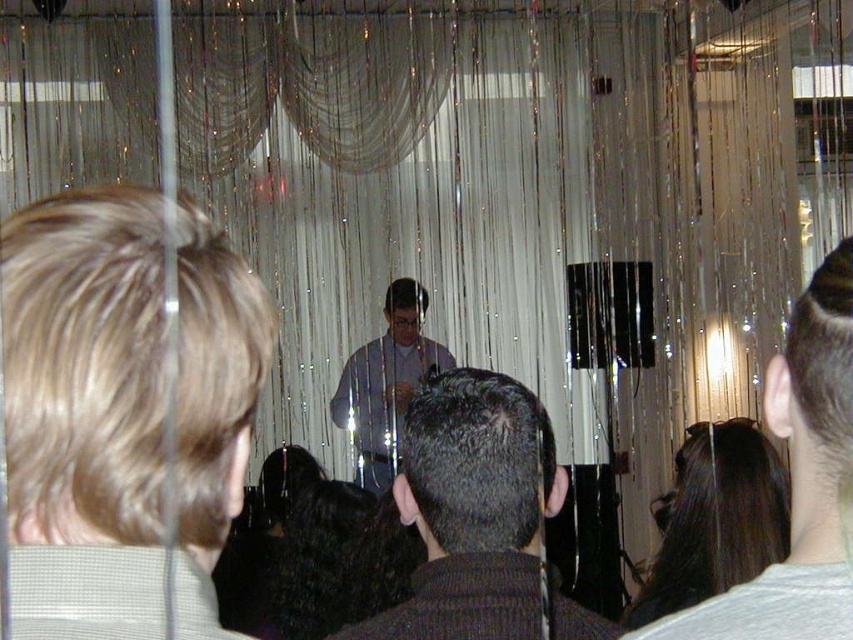
Can you confirm if dark gray knit sweater at center is positioned to the left of dark brown hair at center?

Yes, dark gray knit sweater at center is to the left of dark brown hair at center.

Find the location of a particular element. The height and width of the screenshot is (640, 853). dark gray knit sweater at center is located at coordinates (473, 509).

What do you see at coordinates (473, 509) in the screenshot?
I see `dark gray knit sweater at center` at bounding box center [473, 509].

Does dark gray knit sweater at center have a greater height compared to matte gray shirt at center?

No, dark gray knit sweater at center is not taller than matte gray shirt at center.

Between point (445, 586) and point (392, 340), which one is positioned behind?

The point (392, 340) is behind.

This screenshot has height=640, width=853. I want to click on dark gray knit sweater at center, so click(473, 509).

Who is positioned more to the left, dark brown hair at center or matte gray shirt at center?

Positioned to the left is matte gray shirt at center.

Does point (825, 554) come farther from viewer compared to point (334, 417)?

No, (825, 554) is in front of (334, 417).

Is point (804, 500) positioned before point (387, 404)?

Yes.

You are a GUI agent. You are given a task and a screenshot of the screen. Output one action in this format:
    pyautogui.click(x=<x>, y=<y>)
    Task: Click on the dark brown hair at center
    The width and height of the screenshot is (853, 640).
    Given the screenshot: What is the action you would take?
    pyautogui.click(x=799, y=481)